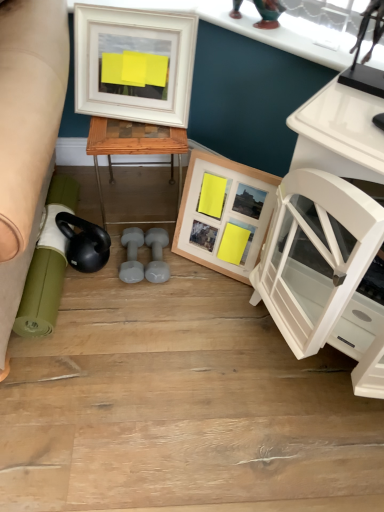
The width and height of the screenshot is (384, 512). What are the coordinates of `white glossy cabinet at right` in the screenshot? It's located at (328, 234).

Where is `green rubber mat at lower left`? green rubber mat at lower left is located at coordinates pyautogui.click(x=47, y=264).

Locate an element on the screen. The image size is (384, 512). white glossy cabinet at right is located at coordinates (328, 234).

How many degrees apart are the facing directions of green rubber mat at lower left and gray rubber dumbbell at center, acting as the 2th dumbbell starting from the right?

The angular difference between green rubber mat at lower left and gray rubber dumbbell at center, acting as the 2th dumbbell starting from the right, is 0.487 degrees.

Consider the image. Is green rubber mat at lower left at the left side of gray rubber dumbbell at center, acting as the 2th dumbbell starting from the right?

Correct, you'll find green rubber mat at lower left to the left of gray rubber dumbbell at center, acting as the 2th dumbbell starting from the right.

From the image's perspective, between green rubber mat at lower left and gray rubber dumbbell at center, the first dumbbell when ordered from left to right, who is located below?

gray rubber dumbbell at center, the first dumbbell when ordered from left to right.

From a real-world perspective, does green rubber mat at lower left stand above gray rubber dumbbell at center, the first dumbbell when ordered from left to right?

Correct, in the physical world, green rubber mat at lower left is higher than gray rubber dumbbell at center, the first dumbbell when ordered from left to right.

Is green rubber mat at lower left thinner than white glossy cabinet at right?

Incorrect, the width of green rubber mat at lower left is not less than that of white glossy cabinet at right.

What's the angular difference between green rubber mat at lower left and white glossy cabinet at right's facing directions?

The angular difference between green rubber mat at lower left and white glossy cabinet at right is 42 degrees.

From the image's perspective, which object appears higher, green rubber mat at lower left or white glossy cabinet at right?

green rubber mat at lower left is shown above in the image.

In the scene shown: Considering their positions, is green rubber mat at lower left located in front of or behind white glossy cabinet at right?

Clearly, green rubber mat at lower left is behind white glossy cabinet at right.

Relative to gray rubber dumbbell at center, acting as the 2th dumbbell starting from the left, is wooden picture frame at center, which is the 2th picture frame from left to right, in front or behind?

wooden picture frame at center, which is the 2th picture frame from left to right, is in front of gray rubber dumbbell at center, acting as the 2th dumbbell starting from the left.

Is wooden picture frame at center, which is the 2th picture frame from left to right, to the right of gray rubber dumbbell at center, acting as the 2th dumbbell starting from the left, from the viewer's perspective?

Yes.

Considering the sizes of objects white matte picture frame at upper left, which ranks as the 1th picture frame in left-to-right order, and gray rubber dumbbell at center, acting as the 2th dumbbell starting from the right, in the image provided, who is shorter, white matte picture frame at upper left, which ranks as the 1th picture frame in left-to-right order, or gray rubber dumbbell at center, acting as the 2th dumbbell starting from the right,?

gray rubber dumbbell at center, acting as the 2th dumbbell starting from the right, is shorter.

Is white matte picture frame at upper left, the first picture frame from the top, beside gray rubber dumbbell at center, acting as the 2th dumbbell starting from the right?

They are not placed beside each other.

Is point (126, 106) positioned behind point (135, 274)?

That is False.

From a real-world perspective, which object stands above the other?

white matte picture frame at upper left, arranged as the 2th picture frame when viewed from the right, is physically above.

From the image's perspective, which is below, woodenobject at center or white matte picture frame at upper left, arranged as the 2th picture frame when viewed from the right?

woodenobject at center is shown below in the image.

Considering the sizes of objects woodenobject at center and white matte picture frame at upper left, which is the second picture frame from bottom to top, in the image provided, who is thinner, woodenobject at center or white matte picture frame at upper left, which is the second picture frame from bottom to top,?

white matte picture frame at upper left, which is the second picture frame from bottom to top.

Based on the photo, who is shorter, woodenobject at center or white matte picture frame at upper left, the first picture frame from the top?

white matte picture frame at upper left, the first picture frame from the top.

Find the location of a particular element. table behind the white matte picture frame at upper left, which ranks as the 1th picture frame in left-to-right order is located at coordinates (134, 146).

Between wooden picture frame at center, which is the 2th picture frame from left to right, and white matte picture frame at upper left, which is the second picture frame from bottom to top, which one has less height?

white matte picture frame at upper left, which is the second picture frame from bottom to top, is shorter.

Identify the location of picture frame that appears in front of the wooden picture frame at center, which ranks as the first picture frame in bottom-to-top order. The height and width of the screenshot is (512, 384). (134, 64).

Is white matte picture frame at upper left, which is the second picture frame from bottom to top, at the back of wooden picture frame at center, which ranks as the first picture frame in bottom-to-top order?

That's not correct — wooden picture frame at center, which ranks as the first picture frame in bottom-to-top order, is not looking away from white matte picture frame at upper left, which is the second picture frame from bottom to top.

Which of these two, gray rubber dumbbell at center, the first dumbbell when ordered from left to right, or white matte picture frame at upper left, the first picture frame from the top, is bigger?

With larger size is white matte picture frame at upper left, the first picture frame from the top.

In the image, is gray rubber dumbbell at center, acting as the 2th dumbbell starting from the right, on the left side or the right side of white matte picture frame at upper left, arranged as the 2th picture frame when viewed from the right?

From the image, it's evident that gray rubber dumbbell at center, acting as the 2th dumbbell starting from the right, is to the left of white matte picture frame at upper left, arranged as the 2th picture frame when viewed from the right.

From a real-world perspective, between gray rubber dumbbell at center, acting as the 2th dumbbell starting from the right, and white matte picture frame at upper left, arranged as the 2th picture frame when viewed from the right, who is vertically higher?

In real-world perspective, white matte picture frame at upper left, arranged as the 2th picture frame when viewed from the right, is above.

Identify the location of the 2nd dumbbell positioned below the white matte picture frame at upper left, which ranks as the 1th picture frame in left-to-right order (from the image's perspective). (132, 255).

Locate an element on the screen. rolling pin in front of the gray rubber dumbbell at center, the first dumbbell when ordered from left to right is located at coordinates (47, 264).

Locate an element on the screen. computer desk above the green rubber mat at lower left (from a real-world perspective) is located at coordinates (328, 234).

Based on their spatial positions, is gray rubber dumbbell at center, the first dumbbell when ordered from left to right, or woodenobject at center further from white glossy cabinet at right?

Among the two, gray rubber dumbbell at center, the first dumbbell when ordered from left to right, is located further to white glossy cabinet at right.

Based on their spatial positions, is white glossy cabinet at right or white matte picture frame at upper left, which ranks as the 1th picture frame in left-to-right order, closer to green rubber mat at lower left?

white matte picture frame at upper left, which ranks as the 1th picture frame in left-to-right order, is positioned closer to the anchor green rubber mat at lower left.

Which object lies further to the anchor point gray rubber dumbbell at center, acting as the 2th dumbbell starting from the right, green rubber mat at lower left or wooden picture frame at center, which is the 2th picture frame from left to right?

Among the two, wooden picture frame at center, which is the 2th picture frame from left to right, is located further to gray rubber dumbbell at center, acting as the 2th dumbbell starting from the right.

From the image, which object appears to be nearer to white matte picture frame at upper left, which ranks as the 1th picture frame in left-to-right order, white glossy cabinet at right or gray rubber dumbbell at center, the 1th dumbbell from the right?

gray rubber dumbbell at center, the 1th dumbbell from the right, lies closer to white matte picture frame at upper left, which ranks as the 1th picture frame in left-to-right order, than the other object.

From the image, which object appears to be farther from woodenobject at center, gray rubber dumbbell at center, acting as the 2th dumbbell starting from the right, or white glossy cabinet at right?

Among the two, white glossy cabinet at right is located further to woodenobject at center.

From the image, which object appears to be nearer to white glossy cabinet at right, wooden picture frame at center, which appears as the second picture frame when viewed from the top, or gray rubber dumbbell at center, acting as the 2th dumbbell starting from the left?

wooden picture frame at center, which appears as the second picture frame when viewed from the top, lies closer to white glossy cabinet at right than the other object.

When comparing their distances from gray rubber dumbbell at center, the 1th dumbbell from the right, does woodenobject at center or wooden picture frame at center, which appears as the second picture frame when viewed from the top, seem closer?

wooden picture frame at center, which appears as the second picture frame when viewed from the top, is closer to gray rubber dumbbell at center, the 1th dumbbell from the right.

From the image, which object appears to be farther from gray rubber dumbbell at center, the 1th dumbbell from the right, gray rubber dumbbell at center, acting as the 2th dumbbell starting from the right, or green rubber mat at lower left?

green rubber mat at lower left lies further to gray rubber dumbbell at center, the 1th dumbbell from the right, than the other object.

Locate an element on the screen. table between white glossy cabinet at right and gray rubber dumbbell at center, acting as the 2th dumbbell starting from the left, from front to back is located at coordinates (134, 146).

Where is `table between white matte picture frame at upper left, the first picture frame from the top, and gray rubber dumbbell at center, the 1th dumbbell from the right, from top to bottom`? The image size is (384, 512). table between white matte picture frame at upper left, the first picture frame from the top, and gray rubber dumbbell at center, the 1th dumbbell from the right, from top to bottom is located at coordinates (134, 146).

Locate an element on the screen. This screenshot has width=384, height=512. picture frame between white matte picture frame at upper left, which ranks as the 1th picture frame in left-to-right order, and gray rubber dumbbell at center, acting as the 2th dumbbell starting from the left, in the up-down direction is located at coordinates (224, 213).

Locate an element on the screen. The height and width of the screenshot is (512, 384). table between white matte picture frame at upper left, the first picture frame from the top, and gray rubber dumbbell at center, acting as the 2th dumbbell starting from the right, vertically is located at coordinates (134, 146).